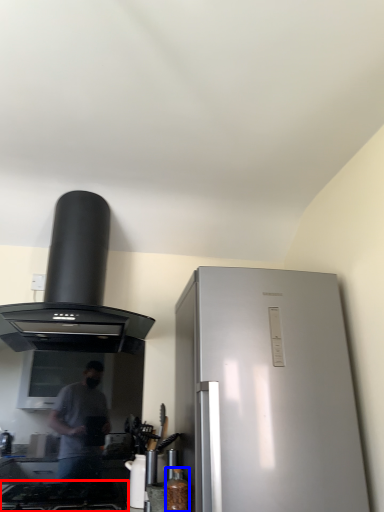
Question: Which object is further to the camera taking this photo, gas stove (highlighted by a red box) or bottle (highlighted by a blue box)?

Choices:
 (A) gas stove
 (B) bottle

Answer: (B)